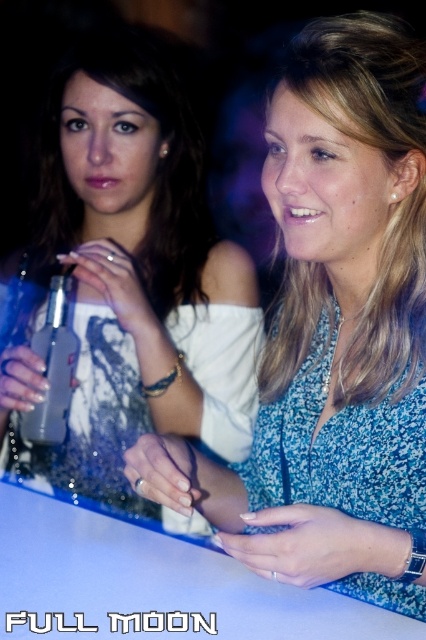
Question: Can you confirm if matte white dress at center is positioned to the left of matte black dress at upper left?

Choices:
 (A) no
 (B) yes

Answer: (A)

Question: Is matte white dress at center to the left of matte black dress at upper left from the viewer's perspective?

Choices:
 (A) no
 (B) yes

Answer: (A)

Question: Can you confirm if matte white dress at center is bigger than clear glass bottle at center?

Choices:
 (A) no
 (B) yes

Answer: (B)

Question: Which of these objects is positioned closest to the matte white dress at center?

Choices:
 (A) clear glass bottle at center
 (B) matte black dress at upper left

Answer: (B)

Question: Considering the real-world distances, which object is closest to the matte black dress at upper left?

Choices:
 (A) clear glass bottle at center
 (B) matte white dress at center

Answer: (A)

Question: Which object is farther from the camera taking this photo?

Choices:
 (A) clear glass bottle at center
 (B) matte black dress at upper left

Answer: (A)